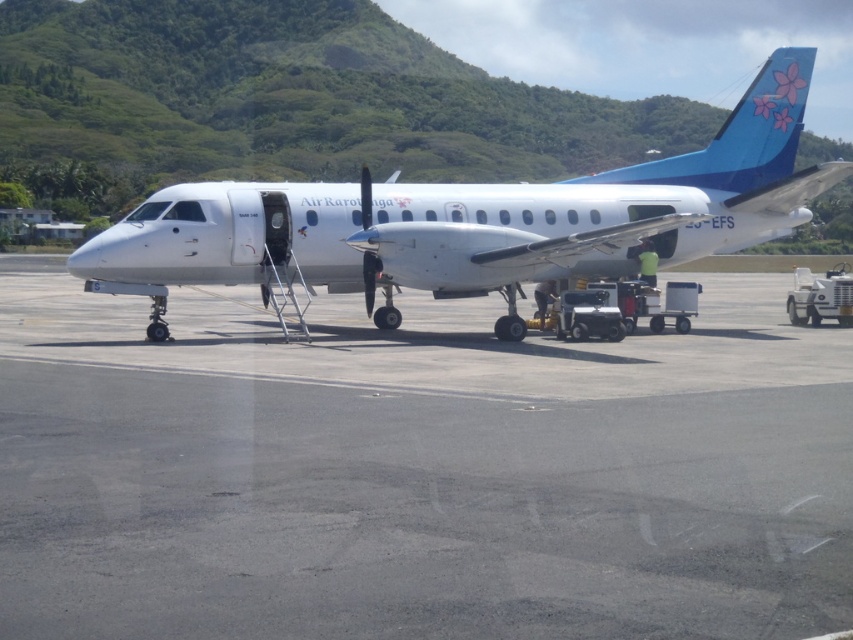
You are standing at the point labeled point (416, 472). Which direction should you walk to reach the Air Rarotonga aircraft?

The point (416, 472) is on the gray asphalt tarmac at center, so you should walk towards the aircraft which is parked on the tarmac. Since the aircraft is depicted with its nose pointed slightly towards the left side of the frame, the direction to walk would depend on your orientation relative to the scene. However, since the point is at the center of the tarmac, walking towards the left side of the frame where the aircraft is positioned would lead you to the Air Rarotonga aircraft.

You are a pilot who just landed the Air Rarotonga plane and need to taxi to the terminal. The terminal is located at point 0.75, 0.5. Can you safely taxi from your current position on the gray asphalt tarmac at center to the terminal without moving more than 0.05 units away from the direct path?

The gray asphalt tarmac at center is at point (416, 472). The terminal is at (426, 480). The distance between them is sqrt of squared differences of coordinates. The difference in x is 0.012, y is 0.01. The distance is sqrt of 0.000144 plus 0.0001, which is sqrt of 0.000244, approximately 0.0156. Since 0.0156 is less than 0.05, the pilot can safely taxi without deviating more than 0.05 units.